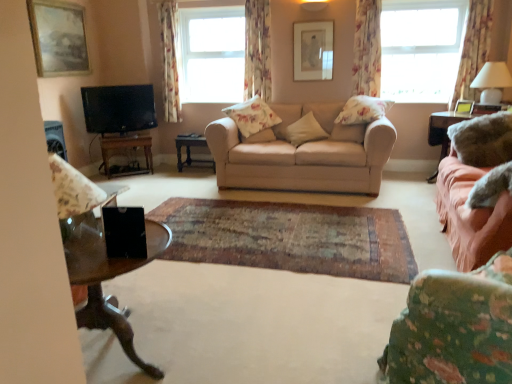
Find the location of a particular element. This screenshot has width=512, height=384. unoccupied space behind transparent glass coffee table at lower left is located at coordinates (173, 287).